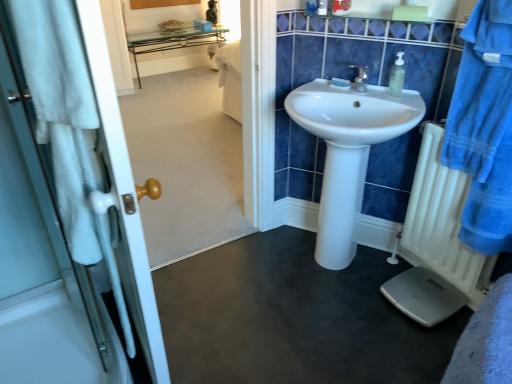
You are a GUI agent. You are given a task and a screenshot of the screen. Output one action in this format:
    pyautogui.click(x=<x>, y=<y>)
    Task: Click on the free space above smooth white scale at center (from a real-world perspective)
    
    Given the screenshot: What is the action you would take?
    pyautogui.click(x=294, y=296)